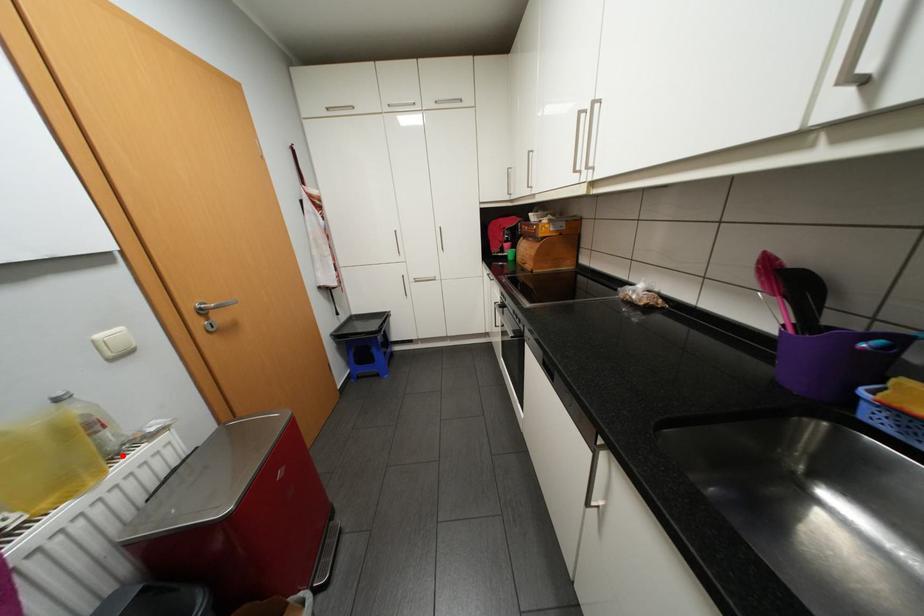
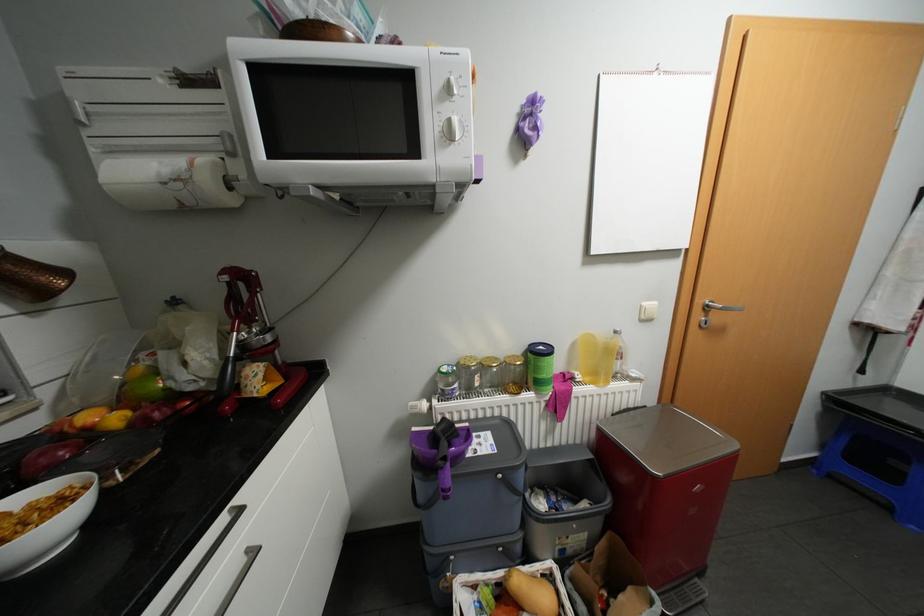
The point at the highlighted location is marked in the first image. Where is the corresponding point in the second image?

(622, 377)